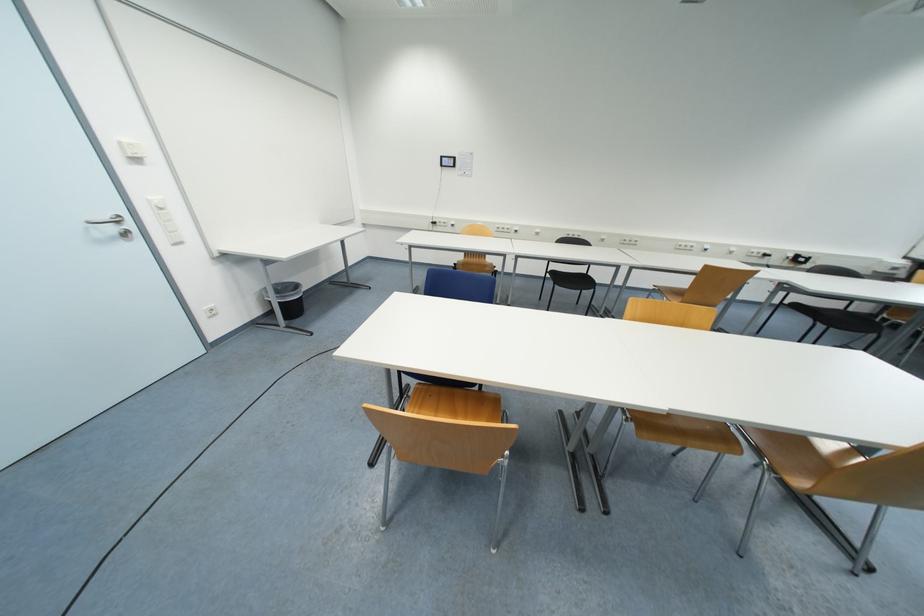
Find the location of a particular element. black chair sitting surface is located at coordinates (572, 280).